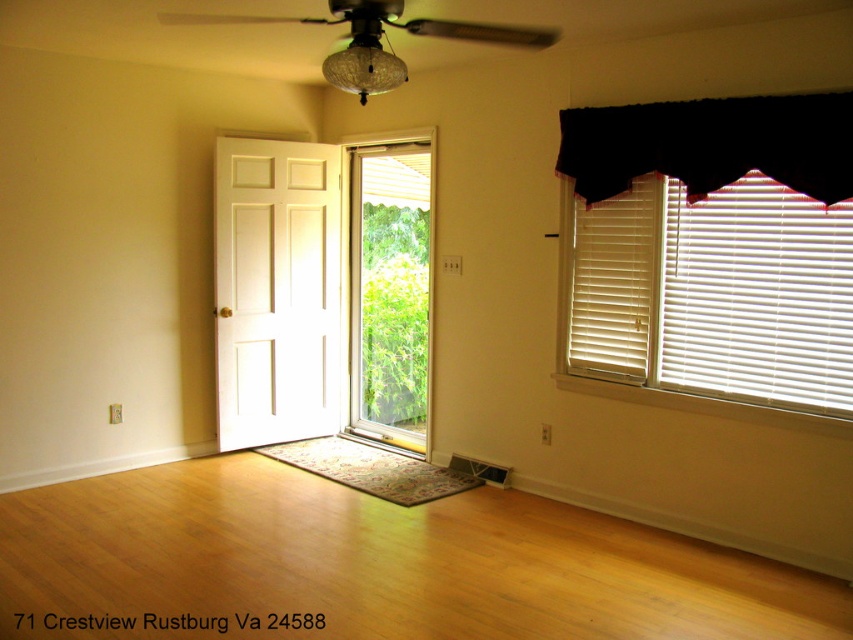
Who is positioned more to the right, white glossy screen door at center or black fabric valance at upper right?

From the viewer's perspective, black fabric valance at upper right appears more on the right side.

Can you confirm if white glossy screen door at center is positioned above black fabric valance at upper right?

Incorrect, white glossy screen door at center is not positioned above black fabric valance at upper right.

Which is in front, point (260, 227) or point (795, 125)?

Point (795, 125)

Locate an element on the screen. Image resolution: width=853 pixels, height=640 pixels. white glossy screen door at center is located at coordinates (276, 291).

Who is more distant from viewer, (254, 424) or (352, 12)?

Point (254, 424)

Is white glossy screen door at center further to the viewer compared to matte glass ceiling fan at upper center?

Yes, it is.

Which is behind, point (311, 307) or point (387, 17)?

The point (311, 307) is more distant.

Find the location of a particular element. white glossy screen door at center is located at coordinates (276, 291).

Between white wood blinds at right and white glossy screen door at center, which one has more height?

With more height is white glossy screen door at center.

Is point (815, 211) in front of point (213, 211)?

Yes, point (815, 211) is closer to viewer.

This screenshot has width=853, height=640. Find the location of `white wood blinds at right`. white wood blinds at right is located at coordinates (717, 292).